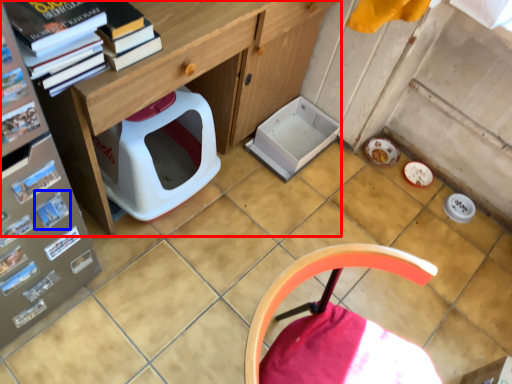
Question: Among these objects, which one is farthest to the camera, desk (highlighted by a red box) or magazine (highlighted by a blue box)?

Choices:
 (A) desk
 (B) magazine

Answer: (B)